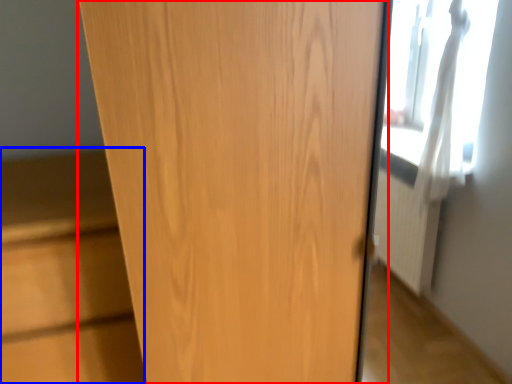
Question: Which of the following is the closest to the observer, door (highlighted by a red box) or cabinetry (highlighted by a blue box)?

Choices:
 (A) door
 (B) cabinetry

Answer: (A)